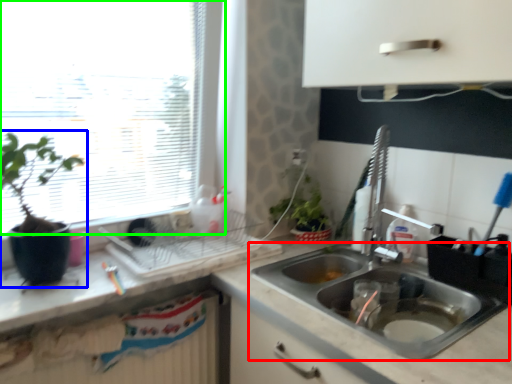
Question: Which object is the closest to the sink (highlighted by a red box)? Choose among these: houseplant (highlighted by a blue box) or window (highlighted by a green box).

Choices:
 (A) houseplant
 (B) window

Answer: (B)